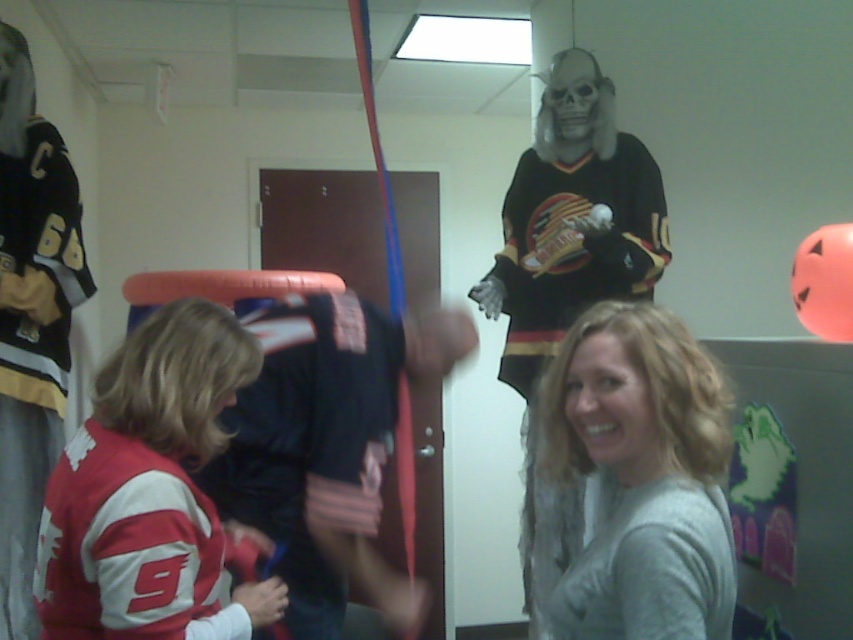
Question: Does dark blue jersey at center have a smaller size compared to smooth skin face at center?

Choices:
 (A) no
 (B) yes

Answer: (A)

Question: Which point appears farthest from the camera in this image?

Choices:
 (A) (584, 339)
 (B) (514, 262)
 (C) (271, 369)
 (D) (694, 616)

Answer: (B)

Question: Considering the relative positions of gray matte shirt at center and smooth skin face at center in the image provided, where is gray matte shirt at center located with respect to smooth skin face at center?

Choices:
 (A) below
 (B) above

Answer: (A)

Question: Which of the following is the closest to the observer?

Choices:
 (A) (550, 92)
 (B) (560, 394)

Answer: (B)

Question: Is matte black jersey at left thinner than smooth skin face at center?

Choices:
 (A) no
 (B) yes

Answer: (A)

Question: Which is nearer to the gray matte shirt at center?

Choices:
 (A) matte black hockey jersey at upper center
 (B) smooth skin face at center

Answer: (B)